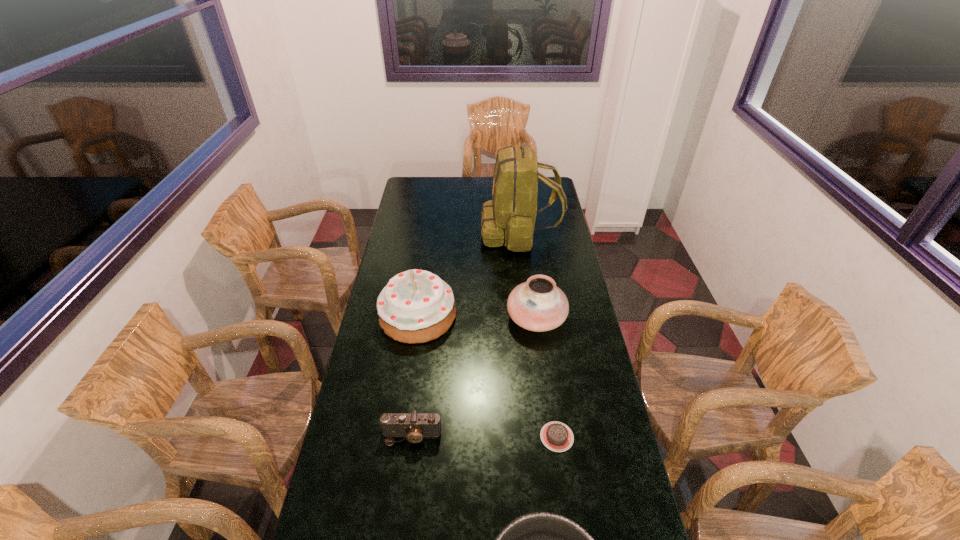
The width and height of the screenshot is (960, 540). Identify the location of the tallest object. (510, 217).

This screenshot has width=960, height=540. In order to click on the farthest object in this screenshot , I will do (x=510, y=217).

The width and height of the screenshot is (960, 540). Identify the location of cake. 416,306.

Where is `pottery`? pottery is located at coordinates (538, 305).

Image resolution: width=960 pixels, height=540 pixels. Find the location of `camera`. camera is located at coordinates (414, 426).

Where is `the shortest object`? Image resolution: width=960 pixels, height=540 pixels. the shortest object is located at coordinates (556, 436).

This screenshot has height=540, width=960. In order to click on vacant space positioned 0.340m on the front-facing side of the backpack in this screenshot , I will do `click(411, 232)`.

This screenshot has width=960, height=540. I want to click on vacant space positioned on the front-facing side of the backpack, so click(417, 232).

Image resolution: width=960 pixels, height=540 pixels. Find the location of `vacant region located 0.170m on the front-facing side of the backpack`. vacant region located 0.170m on the front-facing side of the backpack is located at coordinates (445, 232).

Identify the location of free space located on the right of the cake. This screenshot has height=540, width=960. (559, 316).